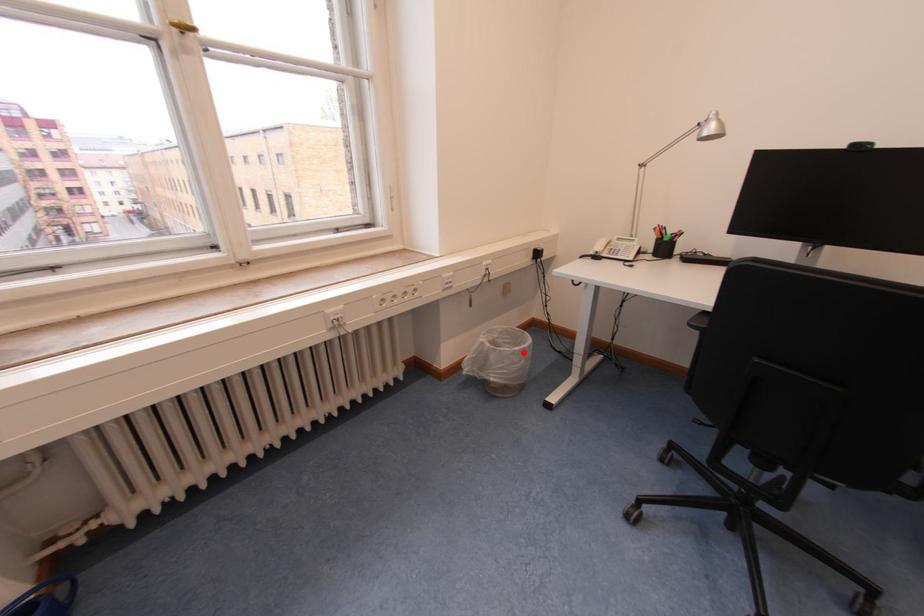
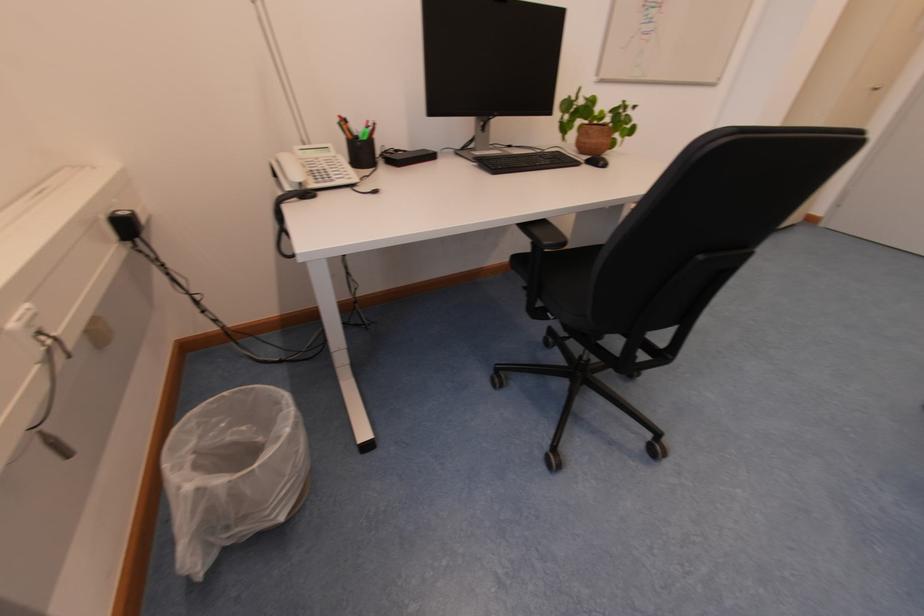
Question: I am providing you with two images of the same scene from different viewpoints. A red point is marked on the first image. Is the red point's position out of view in image 2?

Choices:
 (A) Yes
 (B) No

Answer: (B)